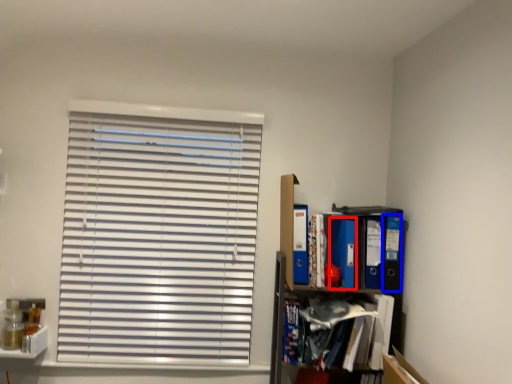
Question: Which object is closer to the camera taking this photo, paperback book (highlighted by a red box) or paperback book (highlighted by a blue box)?

Choices:
 (A) paperback book
 (B) paperback book

Answer: (B)